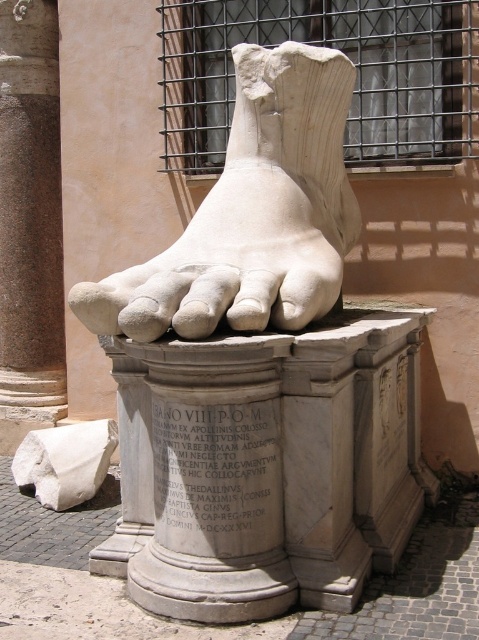
You are standing in front of the pedestal with the white marble block at lower left. You want to place a small flower bouquet on the white marble foot at center. Can you walk directly forward to reach it without moving sideways?

The white marble foot at center is to the right of the white marble block at lower left, so you need to move to the right to reach it. Walking directly forward won me not align you with the foot, so you must adjust your position sideways.